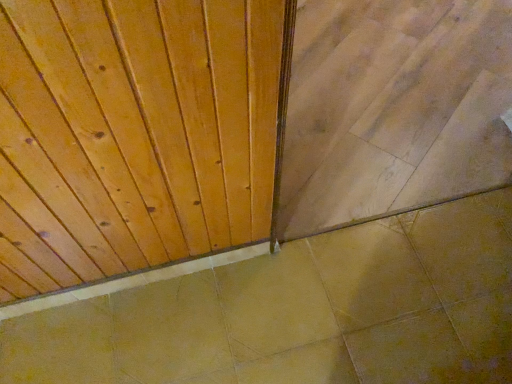
Find the location of `empty space that is ontop of yellowish concrete at bottom (from a real-world perspective)`. empty space that is ontop of yellowish concrete at bottom (from a real-world perspective) is located at coordinates (298, 332).